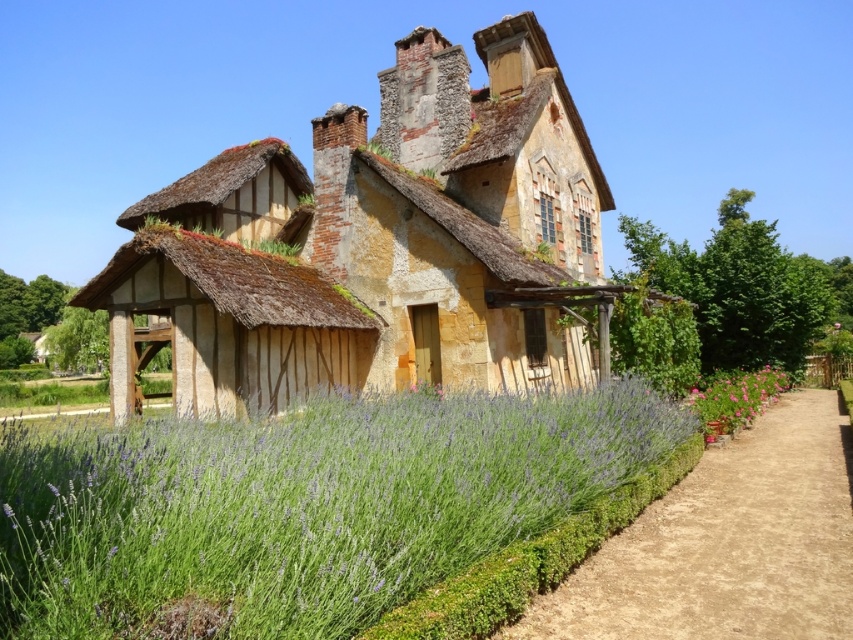
Which is in front, point (811, 412) or point (728, 422)?

Positioned in front is point (728, 422).

Is point (839, 556) farther from camera compared to point (786, 388)?

No, it is not.

Which is in front, point (836, 628) or point (700, 410)?

Point (836, 628) is in front.

Find the location of `dirt path at center`. dirt path at center is located at coordinates (727, 544).

Between purple soft lavender at center and dirt path at center, which one is positioned higher?

purple soft lavender at center is above.

Describe the element at coordinates (299, 504) in the screenshot. This screenshot has height=640, width=853. I see `purple soft lavender at center` at that location.

Identify the location of purple soft lavender at center. (299, 504).

Is yellowish stone cottage at center taller than purple soft lavender at center?

Indeed, yellowish stone cottage at center has a greater height compared to purple soft lavender at center.

Is yellowish stone cottage at center positioned in front of purple soft lavender at center?

That is False.

Between point (401, 61) and point (390, 595), which one is positioned behind?

Point (401, 61)

Where is `yellowish stone cottage at center`? yellowish stone cottage at center is located at coordinates (379, 244).